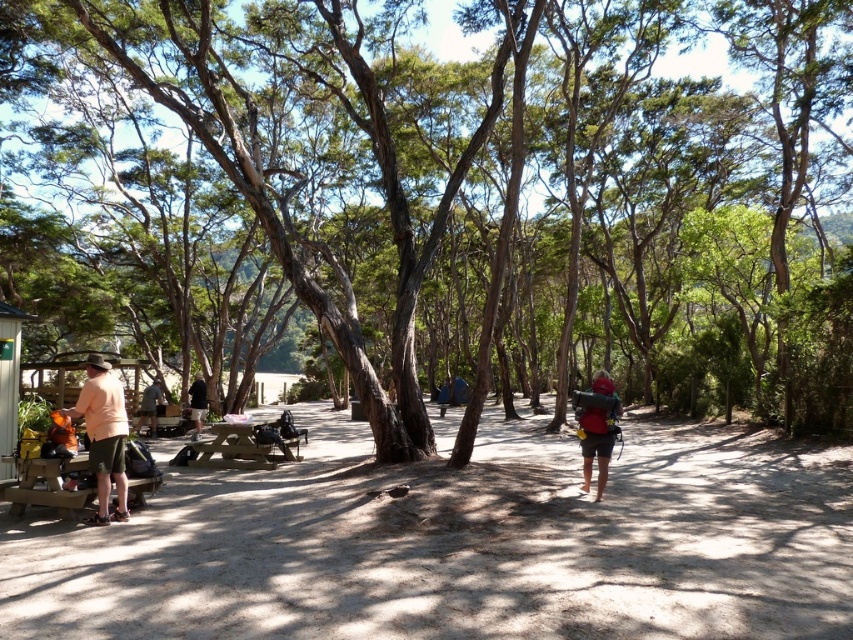
You are a hiker who just arrived at the campsite and wants to place your 1.5 meter long tent between the brown textured tree at center and the dark brown leather backpack at center. Is there enough space to set it up without moving either object?

The distance between the brown textured tree at center and the dark brown leather backpack at center is 13.92 meters, which is more than enough space to place a 1.5 meter long tent between them without moving either object.

You are standing at the picnic table and want to place a small backpack on the ground. The backpack is 0.3 meters wide. There is a brown textured tree at center located at point (492, 177). Can you safely place the backpack at that point without it being under the tree?

The brown textured tree at center is located at point (492, 177). Since the tree is at that exact point, placing the backpack there would mean it is directly under the tree. Therefore, you cannot safely place the backpack at that point without it being under the tree.